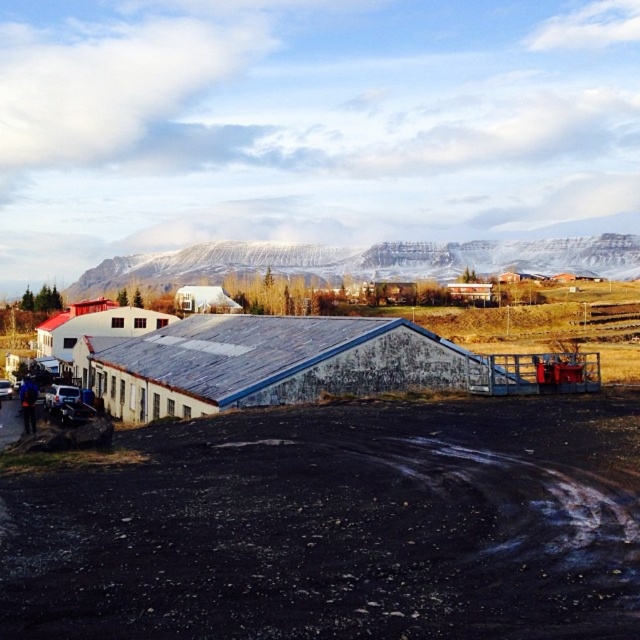
From the picture: You are standing at the entrance of the main building and want to reach the snowy rock formation at upper center. Which path should you take, the black gravel dirt track at lower left or another route?

The black gravel dirt track at lower left is closer to the viewer than the snowy rock formation at upper center. Therefore, you should take the black gravel dirt track at lower left to reach the snowy rock formation at upper center as it is the nearest path available.

You are planning to drive a large truck through the black gravel dirt track at lower left. Considering the size of the track, will it be possible to pass through without damaging the truck or the surrounding snowy rock formation at upper center?

The black gravel dirt track at lower left has a smaller size compared to snowy rock formation at upper center, so the truck may not fit through the track without risking damage to the vehicle or the nearby snowy rock formation at upper center.

You are standing at the center of the image and see the black gravel dirt track at lower left. Can you walk directly to the point marked at coordinate point (x=339, y=525) without crossing any obstacles?

The black gravel dirt track at lower left is located at point (x=339, y=525), so yes, you can walk directly to that point without crossing any obstacles.